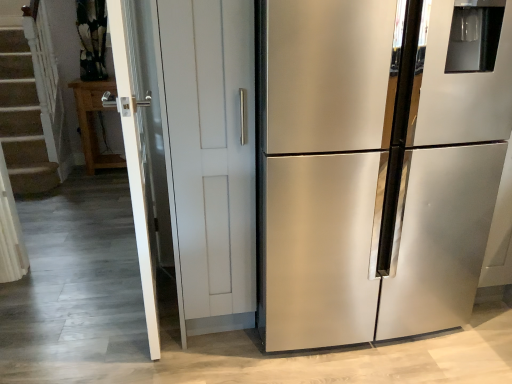
In order to click on white glossy screen door at left in this screenshot , I will do `click(134, 170)`.

Identify the location of wooden cabinet at left. (93, 122).

Identify the location of stainless steel refrigerator at right. (376, 165).

Does wooden cabinet at left appear on the left side of white glossy screen door at left?

Correct, you'll find wooden cabinet at left to the left of white glossy screen door at left.

Between point (90, 125) and point (152, 277), which one is positioned in front?

The point (152, 277) is in front.

Is wooden cabinet at left in front of or behind white glossy screen door at left in the image?

In the image, wooden cabinet at left appears behind white glossy screen door at left.

From a real-world perspective, who is located higher, wooden cabinet at left or white glossy screen door at left?

white glossy screen door at left, from a real-world perspective.

Between stainless steel refrigerator at right and white glossy screen door at left, which one appears on the left side from the viewer's perspective?

white glossy screen door at left is more to the left.

The width and height of the screenshot is (512, 384). Identify the location of screen door that appears on the left of stainless steel refrigerator at right. (134, 170).

Is stainless steel refrigerator at right smaller than white glossy screen door at left?

No, stainless steel refrigerator at right is not smaller than white glossy screen door at left.

Is stainless steel refrigerator at right taller or shorter than white glossy screen door at left?

Considering their sizes, stainless steel refrigerator at right has less height than white glossy screen door at left.

Is white glossy screen door at left with wooden cabinet at left?

white glossy screen door at left and wooden cabinet at left are clearly separated.

In the image, is white glossy screen door at left on the left side or the right side of wooden cabinet at left?

white glossy screen door at left is positioned on wooden cabinet at left's right side.

Based on the photo, is white glossy screen door at left completely or partially outside of wooden cabinet at left?

Yes.

Considering the sizes of white glossy screen door at left and wooden cabinet at left in the image, is white glossy screen door at left bigger or smaller than wooden cabinet at left?

white glossy screen door at left is bigger than wooden cabinet at left.

Looking at their sizes, would you say white glossy screen door at left is wider or thinner than stainless steel refrigerator at right?

Considering their sizes, white glossy screen door at left looks slimmer than stainless steel refrigerator at right.

Would you say white glossy screen door at left is inside or outside stainless steel refrigerator at right?

white glossy screen door at left lies outside stainless steel refrigerator at right.

How many degrees apart are the facing directions of white glossy screen door at left and stainless steel refrigerator at right?

There is a 86.6-degree angle between the facing directions of white glossy screen door at left and stainless steel refrigerator at right.

Is wooden cabinet at left closer to the viewer compared to stainless steel refrigerator at right?

No, it is not.

From a real-world perspective, between wooden cabinet at left and stainless steel refrigerator at right, who is vertically lower?

In real-world perspective, wooden cabinet at left is lower.

Which of these two, wooden cabinet at left or stainless steel refrigerator at right, is wider?

stainless steel refrigerator at right is wider.

Is stainless steel refrigerator at right in contact with wooden cabinet at left?

They are not placed beside each other.

Between stainless steel refrigerator at right and wooden cabinet at left, which one appears on the right side from the viewer's perspective?

stainless steel refrigerator at right is more to the right.

Which of these two, stainless steel refrigerator at right or wooden cabinet at left, is smaller?

wooden cabinet at left is smaller.

From the image's perspective, would you say stainless steel refrigerator at right is positioned over wooden cabinet at left?

No, from the image's perspective, stainless steel refrigerator at right is not over wooden cabinet at left.

Where is `cabinetry located behind the white glossy screen door at left`? This screenshot has width=512, height=384. cabinetry located behind the white glossy screen door at left is located at coordinates (93, 122).

Find the location of `refrigerator on the right side of white glossy screen door at left`. refrigerator on the right side of white glossy screen door at left is located at coordinates (376, 165).

From the picture: Estimate the real-world distances between objects in this image. Which object is closer to stainless steel refrigerator at right, wooden cabinet at left or white glossy screen door at left?

Based on the image, white glossy screen door at left appears to be nearer to stainless steel refrigerator at right.

Based on their spatial positions, is stainless steel refrigerator at right or wooden cabinet at left further from white glossy screen door at left?

Among the two, wooden cabinet at left is located further to white glossy screen door at left.

Considering their positions, is white glossy screen door at left positioned further to wooden cabinet at left than stainless steel refrigerator at right?

Based on the image, stainless steel refrigerator at right appears to be further to wooden cabinet at left.

Which object lies further to the anchor point stainless steel refrigerator at right, white glossy screen door at left or wooden cabinet at left?

wooden cabinet at left is further to stainless steel refrigerator at right.

When comparing their distances from white glossy screen door at left, does wooden cabinet at left or stainless steel refrigerator at right seem further?

wooden cabinet at left lies further to white glossy screen door at left than the other object.

When comparing their distances from wooden cabinet at left, does stainless steel refrigerator at right or white glossy screen door at left seem further?

The object further to wooden cabinet at left is stainless steel refrigerator at right.

In order to click on screen door located between stainless steel refrigerator at right and wooden cabinet at left in the depth direction in this screenshot , I will do `click(134, 170)`.